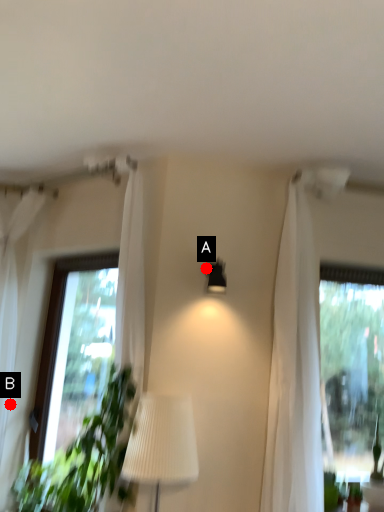
Question: Two points are circled on the image, labeled by A and B beside each circle. Which point appears closest to the camera in this image?

Choices:
 (A) A is closer
 (B) B is closer

Answer: (A)